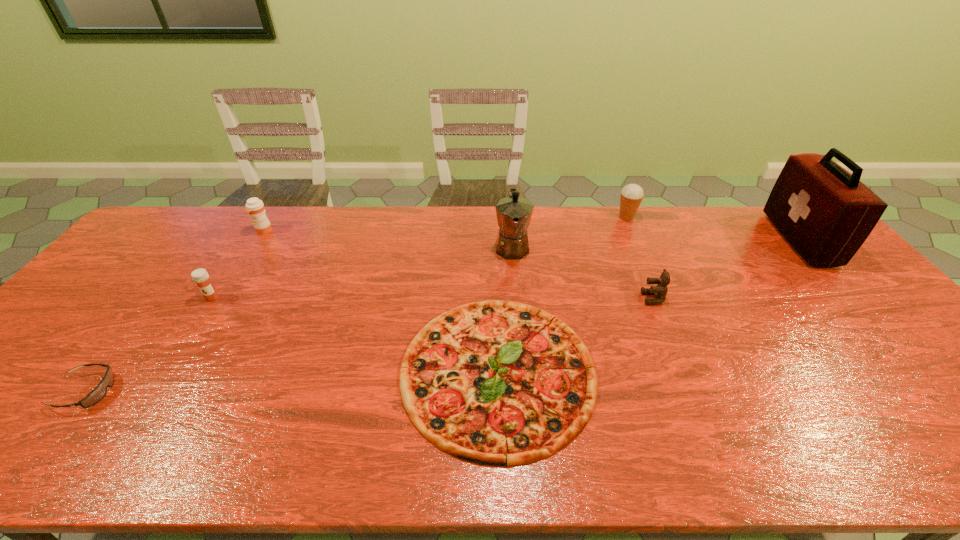
Find the location of a particular element. Image resolution: width=960 pixels, height=540 pixels. the rightmost object is located at coordinates (x=825, y=213).

Identify the location of the tallest object. Image resolution: width=960 pixels, height=540 pixels. (825, 213).

This screenshot has width=960, height=540. What are the coordinates of `coffeepot` in the screenshot? It's located at pos(514,213).

Locate an element on the screen. icecream is located at coordinates (631, 196).

At what (x,y) coordinates should I click in order to perform the action: click on the taller medicine. Please return your answer as a coordinate pair (x, y). Looking at the image, I should click on pos(255,207).

The height and width of the screenshot is (540, 960). In order to click on the shorter medicine in this screenshot , I will do `click(200, 276)`.

The image size is (960, 540). I want to click on teddy bear, so click(x=660, y=291).

The image size is (960, 540). What are the coordinates of `the second shortest object` in the screenshot? It's located at (99, 392).

The width and height of the screenshot is (960, 540). In order to click on the leftmost object in this screenshot , I will do (99, 392).

This screenshot has height=540, width=960. What are the coordinates of `the shortest object` in the screenshot? It's located at (495, 382).